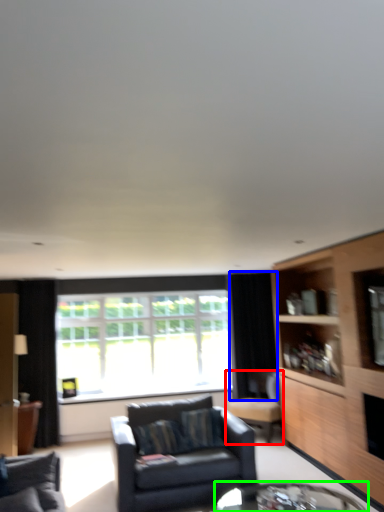
Question: Considering the real-world distances, which object is farthest from chair (highlighted by a red box)? curtain (highlighted by a blue box) or table (highlighted by a green box)?

Choices:
 (A) curtain
 (B) table

Answer: (B)